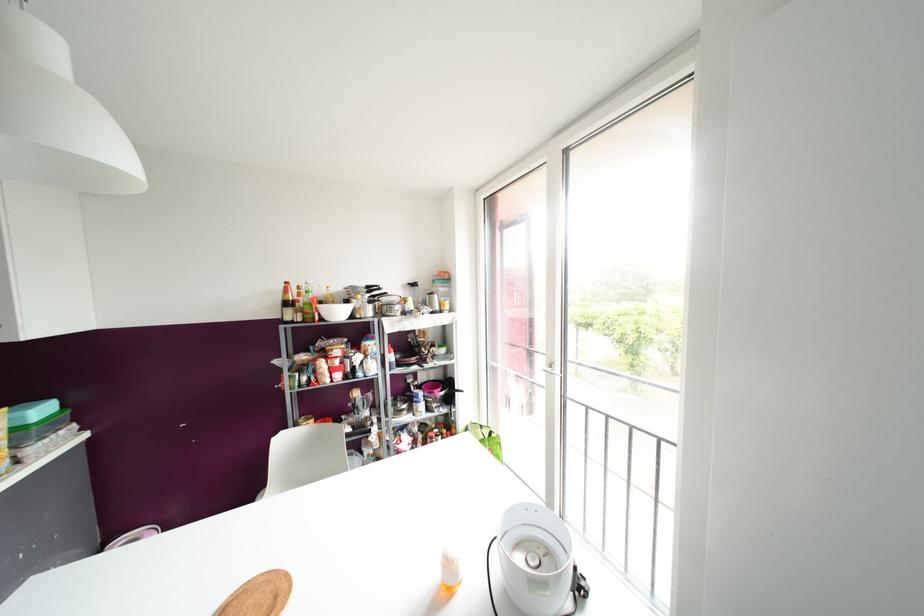
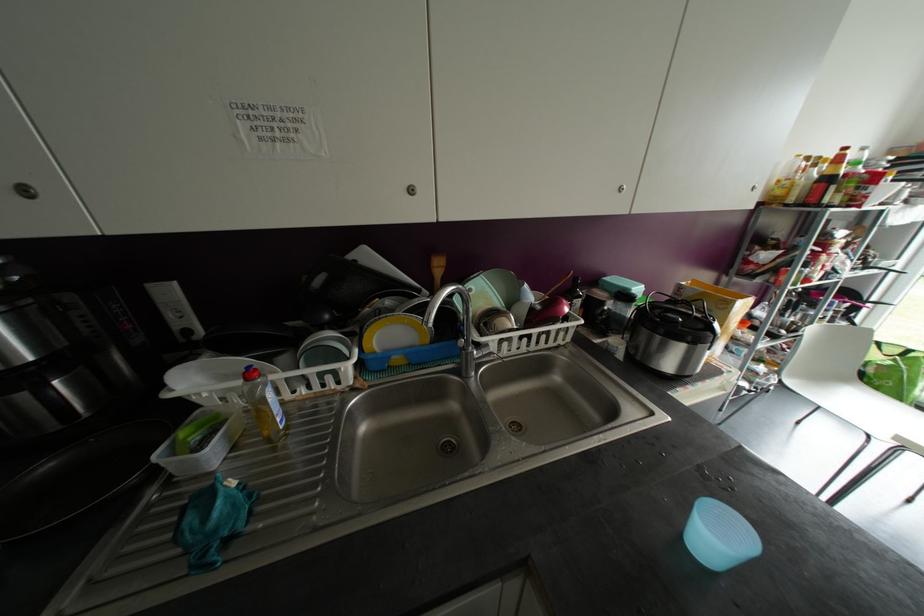
Question: What movement of the cameraman would produce the second image?

Choices:
 (A) Left
 (B) Right
 (C) Forward
 (D) Backward

Answer: (A)